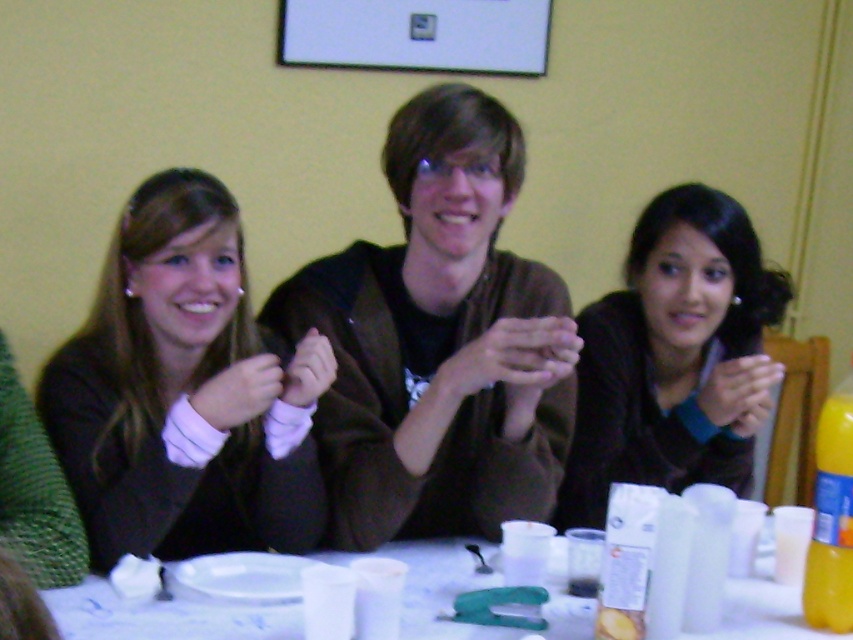
Does brown fuzzy sweater at center appear under white plastic table at lower center?

No, brown fuzzy sweater at center is not below white plastic table at lower center.

Is brown fuzzy sweater at center positioned before white plastic table at lower center?

No, it is behind white plastic table at lower center.

I want to click on brown fuzzy sweater at center, so click(439, 342).

The image size is (853, 640). In order to click on matte black sweater at left in this screenshot , I will do `click(184, 392)`.

Is point (141, 280) positioned behind point (614, 460)?

No, it is not.

Where is `matte black sweater at left`? matte black sweater at left is located at coordinates (184, 392).

Between point (447, 461) and point (640, 419), which one is positioned in front?

Positioned in front is point (447, 461).

Is brown fuzzy sweater at center shorter than dark brown sweater at center?

In fact, brown fuzzy sweater at center may be taller than dark brown sweater at center.

Measure the distance between point (x=450, y=456) and camera.

A distance of 1.61 meters exists between point (x=450, y=456) and camera.

In order to click on brown fuzzy sweater at center in this screenshot , I will do `click(439, 342)`.